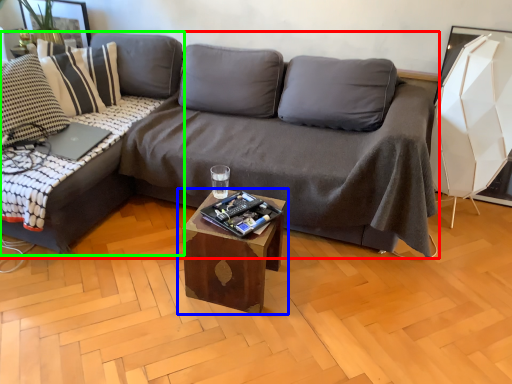
Question: Considering the real-world distances, which object is closest to studio couch (highlighted by a red box)? table (highlighted by a blue box) or studio couch (highlighted by a green box).

Choices:
 (A) table
 (B) studio couch

Answer: (A)